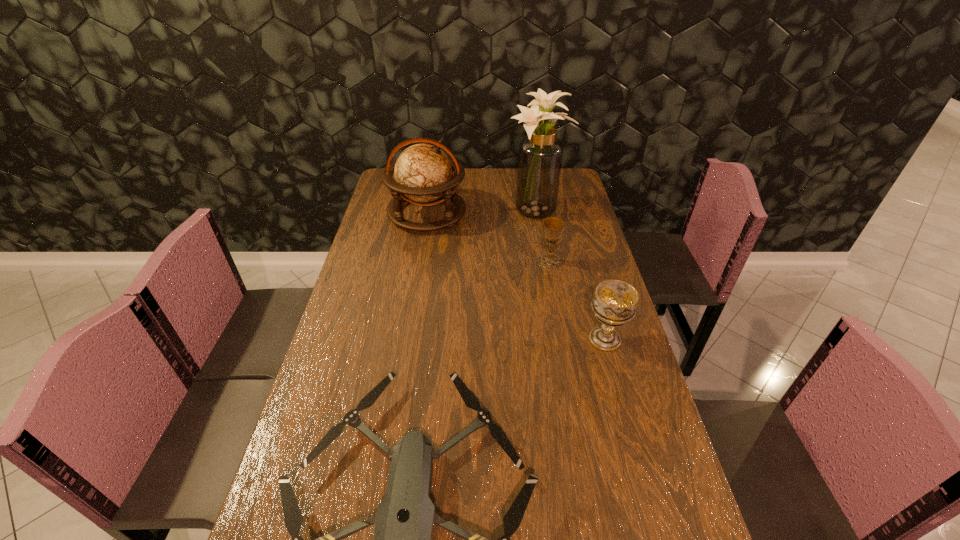
You are a GUI agent. You are given a task and a screenshot of the screen. Output one action in this format:
    pyautogui.click(x=<x>, y=<y>)
    Task: Click on the object positioned at the far edge
    This screenshot has width=960, height=540.
    Given the screenshot: What is the action you would take?
    pyautogui.click(x=423, y=173)

Locate an element on the screen. The image size is (960, 540). object at the left edge is located at coordinates (423, 173).

The width and height of the screenshot is (960, 540). In order to click on flower arrangement that is at the right edge in this screenshot , I will do `click(540, 156)`.

The width and height of the screenshot is (960, 540). Identify the location of object that is at the far left corner. (423, 173).

Where is `free space at the far edge of the desktop`? free space at the far edge of the desktop is located at coordinates (486, 174).

This screenshot has height=540, width=960. Identify the location of vacant space at the left edge. (358, 308).

In the image, there is a desktop. In order to click on blank space at the right edge in this screenshot , I will do point(597,267).

Find the location of `vacant space that is in between the left chalice and the tallest object`. vacant space that is in between the left chalice and the tallest object is located at coordinates (543, 237).

Locate an element on the screen. Image resolution: width=960 pixels, height=540 pixels. empty space between the fourth shortest object and the flower arrangement is located at coordinates (482, 212).

Locate an element on the screen. The image size is (960, 540). free space between the nearer chalice and the flower arrangement is located at coordinates (571, 275).